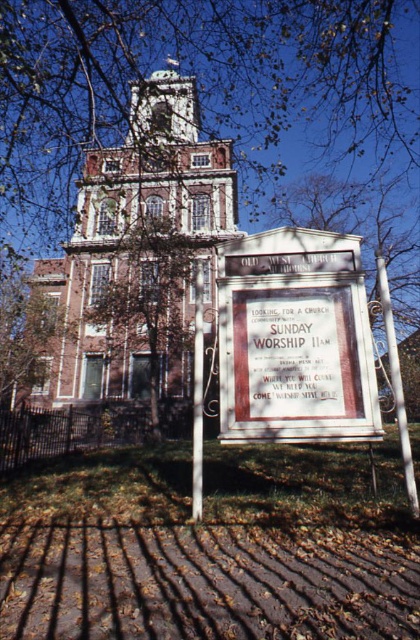
You are a visitor approaching the Old West Church and notice the brown leafy tree at upper center and the white wooden sign at center. Which object is positioned higher in the image?

The brown leafy tree at upper center is positioned higher than the white wooden sign at center.

You are standing at the entrance of Old West Church and want to take a photo of the brown leafy tree at upper center. If your camera can focus on objects up to 7 meters away, will you be able to take a clear photo of the tree?

The brown leafy tree at upper center is 7.11 meters away from the camera. Since the camera can focus up to 7 meters, it cannot capture the tree clearly as it is slightly beyond the maximum distance.

You are standing in front of the Old West Church and want to take a photo of the white wooden sign at center. However, there is a brown leafy tree at upper center in the way. Can you still see the sign clearly?

The brown leafy tree at upper center is taller than the white wooden sign at center, so the tree might block the view of the sign depending on its position. However, since the tree is at upper center and the sign is at center, you can likely position yourself to see the sign below the tree without obstruction.